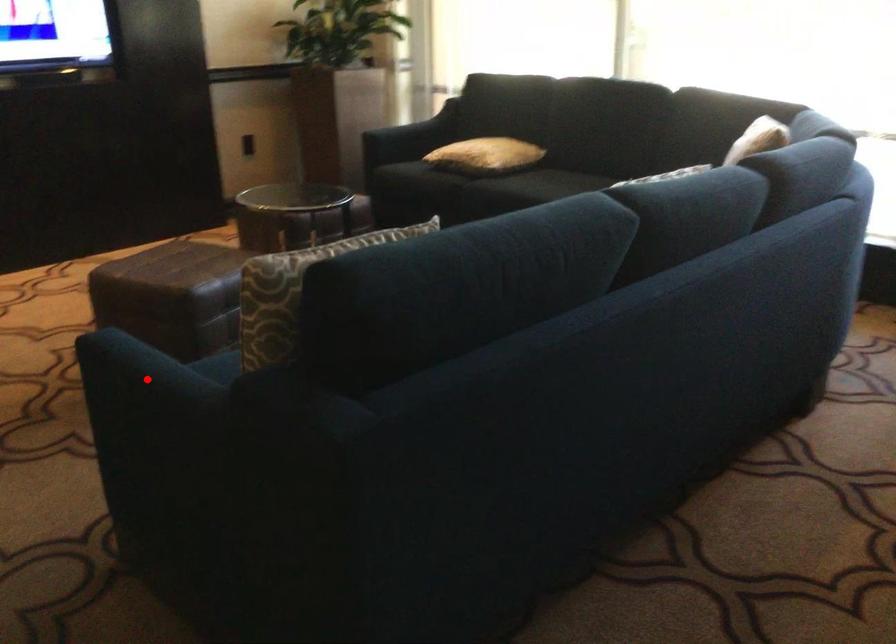
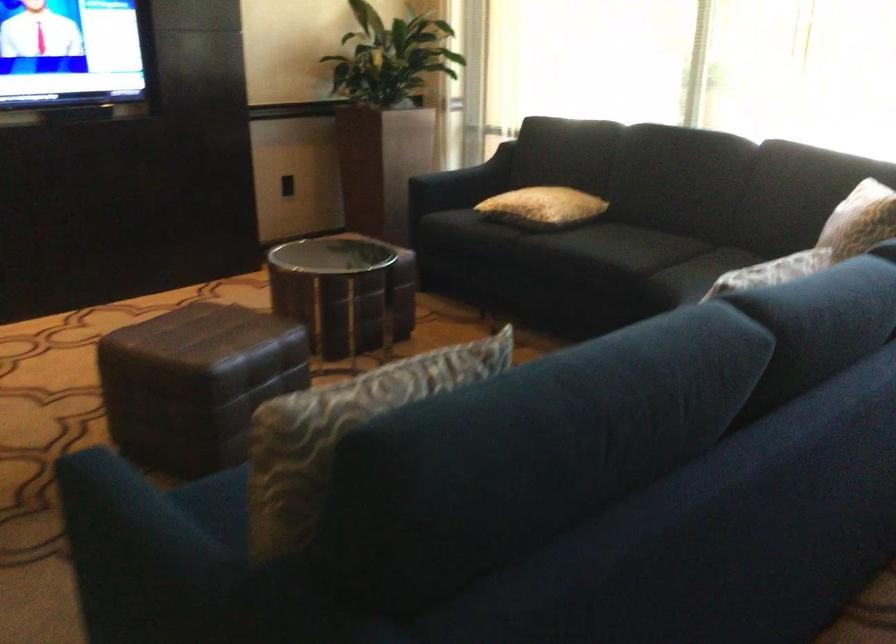
Where in the second image is the point corresponding to the highlighted location from the first image?

(134, 534)